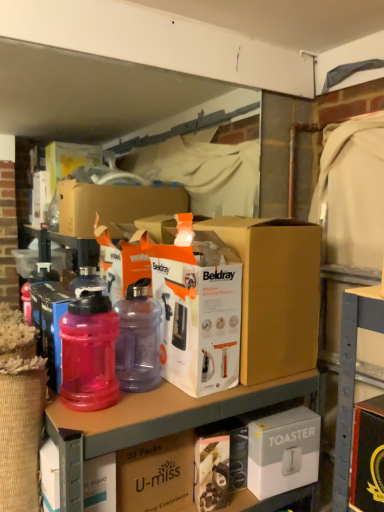
Question: Can you confirm if purple translucent bottle at center, the second bottle when ordered from left to right, is smaller than transparent plastic bottles at upper center?

Choices:
 (A) no
 (B) yes

Answer: (B)

Question: From the image's perspective, would you say purple translucent bottle at center, the second bottle when ordered from left to right, is shown under transparent plastic bottles at upper center?

Choices:
 (A) no
 (B) yes

Answer: (A)

Question: Does purple translucent bottle at center, the second bottle when ordered from left to right, have a larger size compared to transparent plastic bottles at upper center?

Choices:
 (A) no
 (B) yes

Answer: (A)

Question: Can you confirm if purple translucent bottle at center, the first bottle when ordered from right to left, is taller than transparent plastic bottles at upper center?

Choices:
 (A) no
 (B) yes

Answer: (A)

Question: Can you confirm if purple translucent bottle at center, the first bottle when ordered from right to left, is positioned to the right of transparent plastic bottles at upper center?

Choices:
 (A) no
 (B) yes

Answer: (A)

Question: Is point (120, 388) positioned closer to the camera than point (97, 367)?

Choices:
 (A) farther
 (B) closer

Answer: (A)

Question: From a real-world perspective, is purple translucent bottle at center, the second bottle when ordered from left to right, physically located above or below pink translucent bottle at left, which is the 2th bottle in right-to-left order?

Choices:
 (A) below
 (B) above

Answer: (A)

Question: Choose the correct answer: Is purple translucent bottle at center, the first bottle when ordered from right to left, inside pink translucent bottle at left, the first bottle viewed from the left, or outside it?

Choices:
 (A) outside
 (B) inside

Answer: (A)

Question: In terms of height, does purple translucent bottle at center, the second bottle when ordered from left to right, look taller or shorter compared to pink translucent bottle at left, the first bottle viewed from the left?

Choices:
 (A) short
 (B) tall

Answer: (B)

Question: Do you think purple translucent bottle at center, the second bottle when ordered from left to right, is within transparent plastic water bottle at left, acting as the 1th box starting from the left, or outside of it?

Choices:
 (A) outside
 (B) inside

Answer: (A)

Question: Considering their positions, is purple translucent bottle at center, the first bottle when ordered from right to left, located in front of or behind transparent plastic water bottle at left, the 4th box when ordered from right to left?

Choices:
 (A) behind
 (B) front

Answer: (B)

Question: From the image's perspective, is purple translucent bottle at center, the second bottle when ordered from left to right, above or below transparent plastic water bottle at left, the 4th box when ordered from right to left?

Choices:
 (A) below
 (B) above

Answer: (A)

Question: Considering the positions of purple translucent bottle at center, the first bottle when ordered from right to left, and transparent plastic water bottle at left, acting as the 1th box starting from the left, in the image, is purple translucent bottle at center, the first bottle when ordered from right to left, wider or thinner than transparent plastic water bottle at left, acting as the 1th box starting from the left,?

Choices:
 (A) thin
 (B) wide

Answer: (B)

Question: From the image's perspective, is pink translucent bottle at left, which is the 2th bottle in right-to-left order, positioned above or below purple translucent bottle at center, the first bottle when ordered from right to left?

Choices:
 (A) above
 (B) below

Answer: (B)

Question: From a real-world perspective, is pink translucent bottle at left, which is the 2th bottle in right-to-left order, above or below purple translucent bottle at center, the second bottle when ordered from left to right?

Choices:
 (A) below
 (B) above

Answer: (B)